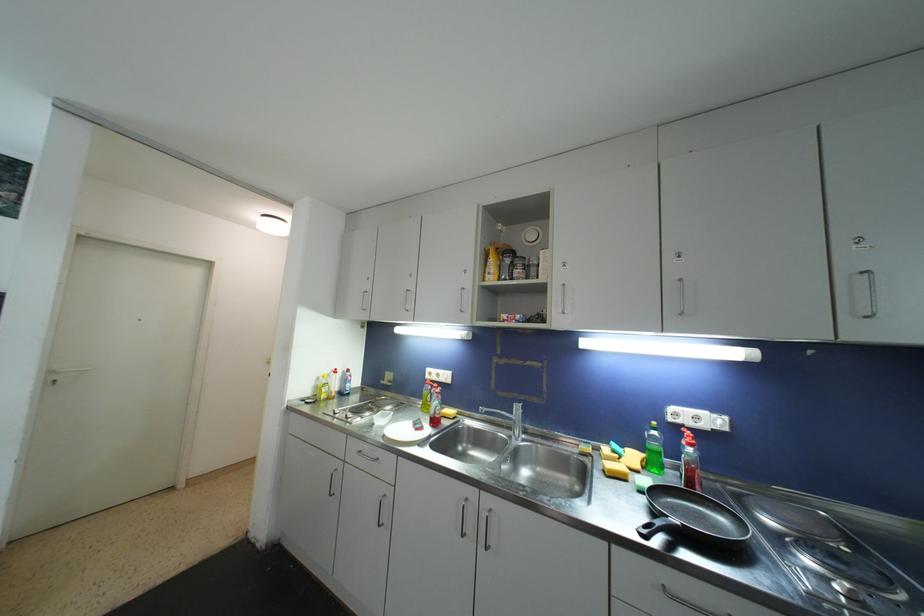
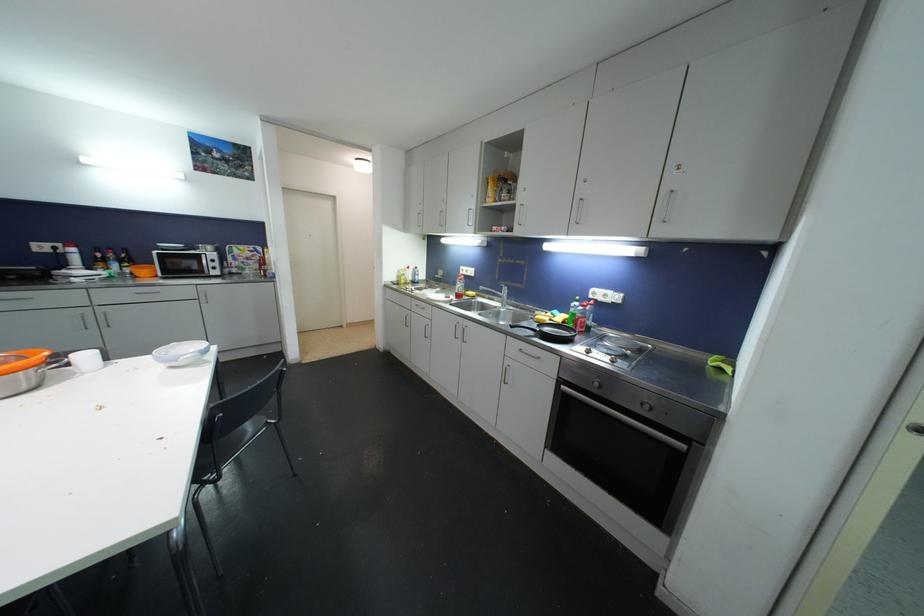
The point at (439,406) is marked in the first image. Where is the corresponding point in the second image?

(463, 288)